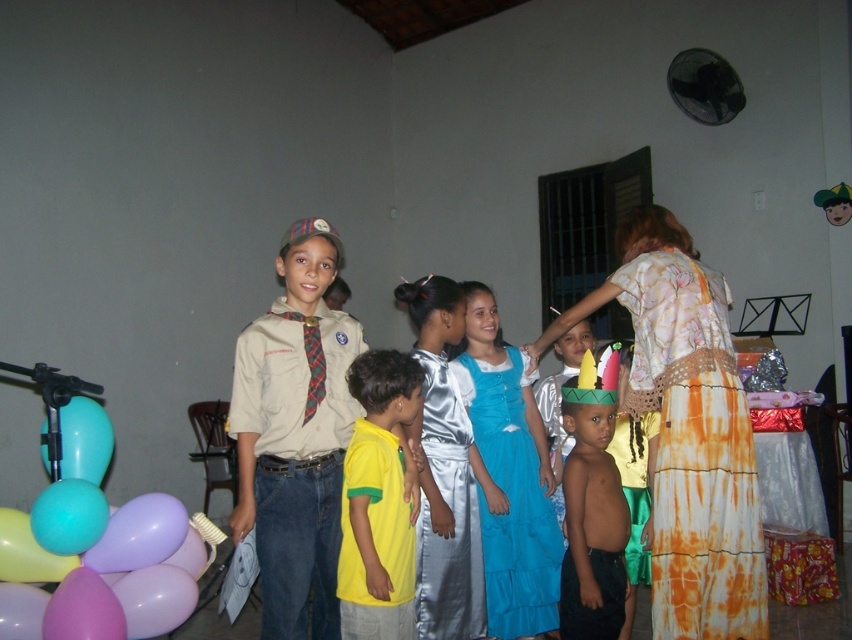
Can you confirm if satin silver dress at center is positioned above translucent blue balloon at lower left?

No.

Between satin silver dress at center and translucent blue balloon at lower left, which one has less height?

translucent blue balloon at lower left

Which is in front, point (442, 554) or point (88, 400)?

Positioned in front is point (442, 554).

At what (x,y) coordinates should I click in order to perform the action: click on satin silver dress at center. Please return your answer as a coordinate pair (x, y). Looking at the image, I should click on (452, 515).

Who is higher up, yellow-green t-shirt at center or satin silver dress at center?

yellow-green t-shirt at center

Does yellow-green t-shirt at center appear over satin silver dress at center?

Indeed, yellow-green t-shirt at center is positioned over satin silver dress at center.

Describe the element at coordinates (378, 502) in the screenshot. This screenshot has width=852, height=640. I see `yellow-green t-shirt at center` at that location.

Image resolution: width=852 pixels, height=640 pixels. What are the coordinates of `yellow-green t-shirt at center` in the screenshot? It's located at (378, 502).

Does khaki cotton shirt at center have a greater width compared to shiny gold crown at center?

Correct, the width of khaki cotton shirt at center exceeds that of shiny gold crown at center.

Can you confirm if khaki cotton shirt at center is bigger than shiny gold crown at center?

Yes, khaki cotton shirt at center is bigger than shiny gold crown at center.

Between point (271, 600) and point (591, 584), which one is positioned behind?

Point (591, 584)

Find the location of a particular element. This screenshot has width=852, height=640. khaki cotton shirt at center is located at coordinates click(x=296, y=456).